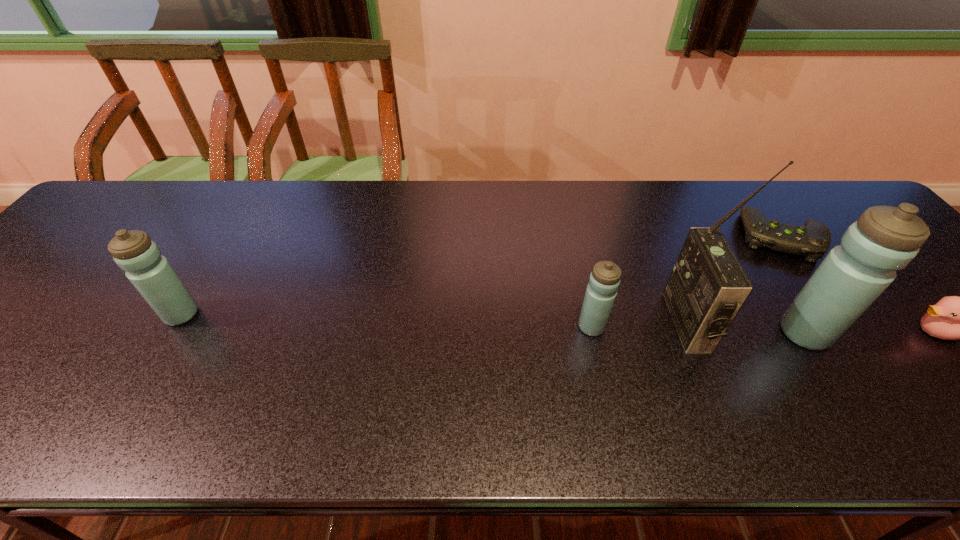
The height and width of the screenshot is (540, 960). I want to click on free space located on the right of the third tallest object, so point(246,315).

The image size is (960, 540). Identify the location of free point located 0.350m on the right of the second object from left to right. (760, 327).

Find the location of `free location located on the front of the second tallest object`. free location located on the front of the second tallest object is located at coordinates (829, 374).

Locate an element on the screen. The height and width of the screenshot is (540, 960). vacant space situated 0.060m on the back of the farthest object is located at coordinates (755, 200).

Locate an element on the screen. The width and height of the screenshot is (960, 540). free space located on the display of the tallest object is located at coordinates (x=540, y=322).

This screenshot has height=540, width=960. In order to click on vacant position located 0.400m on the display of the tallest object in this screenshot , I will do `click(496, 322)`.

Where is `vacant region located 0.140m on the display of the tallest object`? vacant region located 0.140m on the display of the tallest object is located at coordinates (611, 322).

What are the coordinates of `object positioned at the far edge` in the screenshot? It's located at (811, 241).

Locate an element on the screen. The width and height of the screenshot is (960, 540). vacant point at the far edge is located at coordinates (494, 222).

Where is `vacant space at the near edge of the desktop`? This screenshot has width=960, height=540. vacant space at the near edge of the desktop is located at coordinates (66, 367).